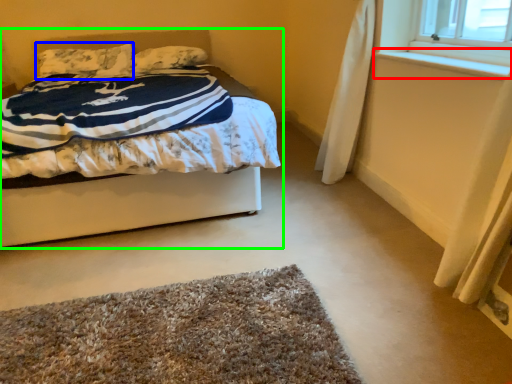
Question: Which object is positioned closest to window sill (highlighted by a red box)? Select from pillow (highlighted by a blue box) and bed (highlighted by a green box).

Choices:
 (A) pillow
 (B) bed

Answer: (B)